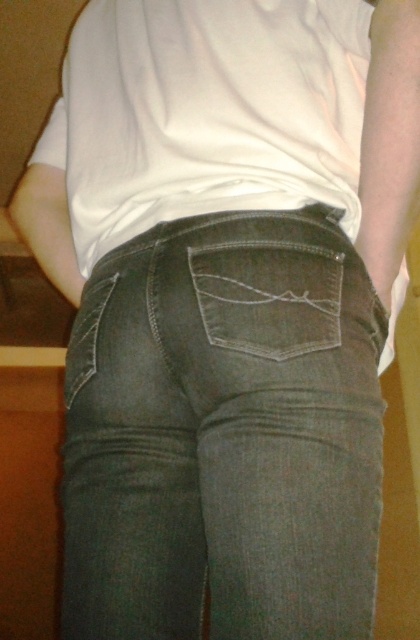
You are a photographer setting up a shoot in a room with a wooden floor and a warm, dimly lit environment. You need to capture a close detail of the dark gray denim jeans at center. If your camera has a focus range of 20 inches, will you need to adjust your position to ensure the jeans are in focus?

The dark gray denim jeans at center is 21.43 inches from camera, which is slightly beyond the camera focus range of 20 inches. You need to move closer to the jeans or adjust the focus range to capture them clearly.

You are examining the back pockets of the jeans in the image. There are two points marked on the pockets. Which point is closer to you, point [247,211] or point [291,355]?

Point [247,211] is closer to you than point [291,355] because it is further to the viewer.

You are a fashion designer trying to create a new line of jeans. You want to ensure that the pocket on the back of the jeans is proportionate to the overall size of the jeans. Based on the image, is the denim pocket at center appropriately sized relative to the dark gray denim jeans at center?

The dark gray denim jeans at center is larger in size than the denim pocket at center, so the pocket is appropriately sized as it is smaller than the jeans.